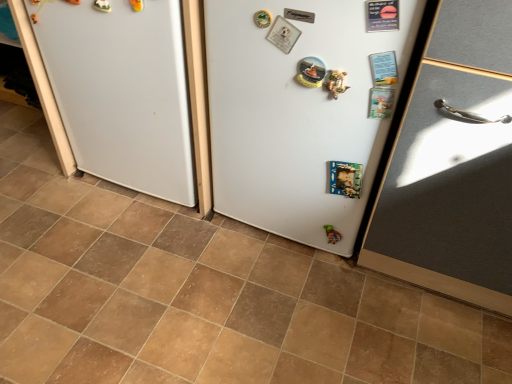
Question: From the image's perspective, does brown tile at center appear higher than white matte refrigerator at center, arranged as the second fridge when viewed from the right?

Choices:
 (A) yes
 (B) no

Answer: (B)

Question: Can you confirm if brown tile at center is bigger than white matte refrigerator at center, which appears as the first fridge when viewed from the left?

Choices:
 (A) yes
 (B) no

Answer: (B)

Question: Can you confirm if brown tile at center is smaller than white matte refrigerator at center, which appears as the first fridge when viewed from the left?

Choices:
 (A) yes
 (B) no

Answer: (A)

Question: Considering the relative positions of brown tile at center and white matte refrigerator at center, arranged as the second fridge when viewed from the right, in the image provided, is brown tile at center to the right of white matte refrigerator at center, arranged as the second fridge when viewed from the right, from the viewer's perspective?

Choices:
 (A) yes
 (B) no

Answer: (B)

Question: Is brown tile at center touching white matte refrigerator at center, arranged as the second fridge when viewed from the right?

Choices:
 (A) yes
 (B) no

Answer: (B)

Question: Considering the relative sizes of brown tile at center and white matte refrigerator at center, arranged as the second fridge when viewed from the right, in the image provided, is brown tile at center shorter than white matte refrigerator at center, arranged as the second fridge when viewed from the right,?

Choices:
 (A) yes
 (B) no

Answer: (A)

Question: Is brown tile at center taller than green matte toy at lower center?

Choices:
 (A) no
 (B) yes

Answer: (A)

Question: Does brown tile at center have a lesser width compared to green matte toy at lower center?

Choices:
 (A) no
 (B) yes

Answer: (A)

Question: Are brown tile at center and green matte toy at lower center far apart?

Choices:
 (A) no
 (B) yes

Answer: (A)

Question: Does brown tile at center come in front of green matte toy at lower center?

Choices:
 (A) no
 (B) yes

Answer: (B)

Question: From the image's perspective, would you say brown tile at center is positioned over green matte toy at lower center?

Choices:
 (A) no
 (B) yes

Answer: (A)

Question: From the image's perspective, does brown tile at center appear lower than green matte toy at lower center?

Choices:
 (A) no
 (B) yes

Answer: (B)

Question: Is matte gray door at right facing away from brown tile at center?

Choices:
 (A) yes
 (B) no

Answer: (B)